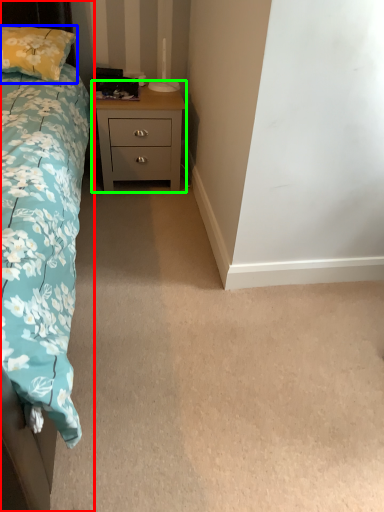
Question: Estimate the real-world distances between objects in this image. Which object is closer to bed (highlighted by a red box), pillow (highlighted by a blue box) or nightstand (highlighted by a green box)?

Choices:
 (A) pillow
 (B) nightstand

Answer: (B)